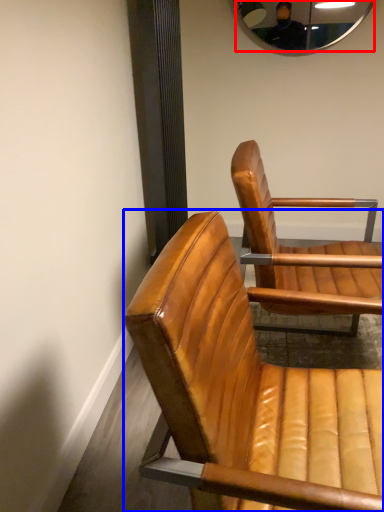
Question: Among these objects, which one is farthest to the camera, mirror (highlighted by a red box) or chair (highlighted by a blue box)?

Choices:
 (A) mirror
 (B) chair

Answer: (A)